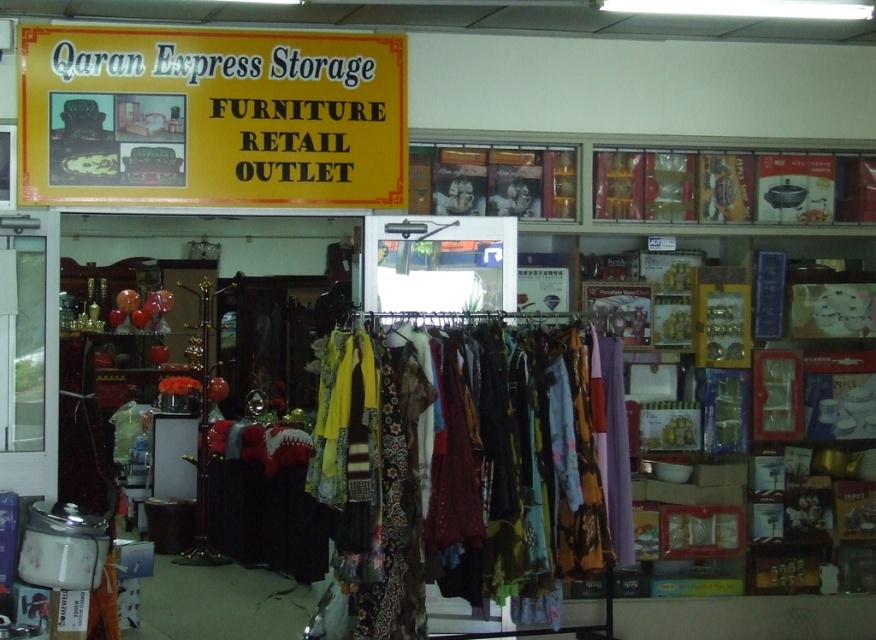
Who is higher up, multicolored fabric dress at center or yellow paper sign at upper center?

yellow paper sign at upper center

Who is more distant from viewer, (451,404) or (41,74)?

The point (41,74) is behind.

Which is in front, point (491, 525) or point (383, 38)?

Point (491, 525) is in front.

Identify the location of multicolored fabric dress at center. The height and width of the screenshot is (640, 876). (456, 467).